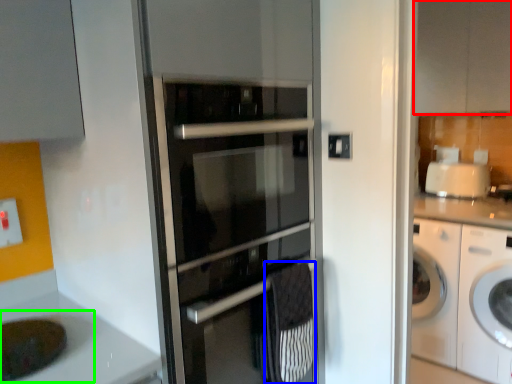
Question: Estimate the real-world distances between objects in this image. Which object is closer to cabinetry (highlighted by a red box), material (highlighted by a blue box) or sink (highlighted by a green box)?

Choices:
 (A) material
 (B) sink

Answer: (A)